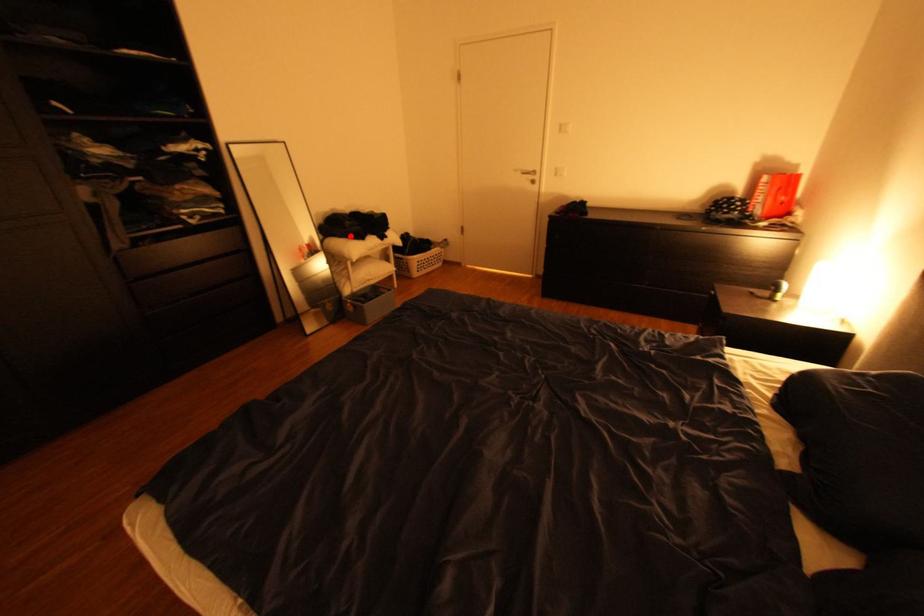
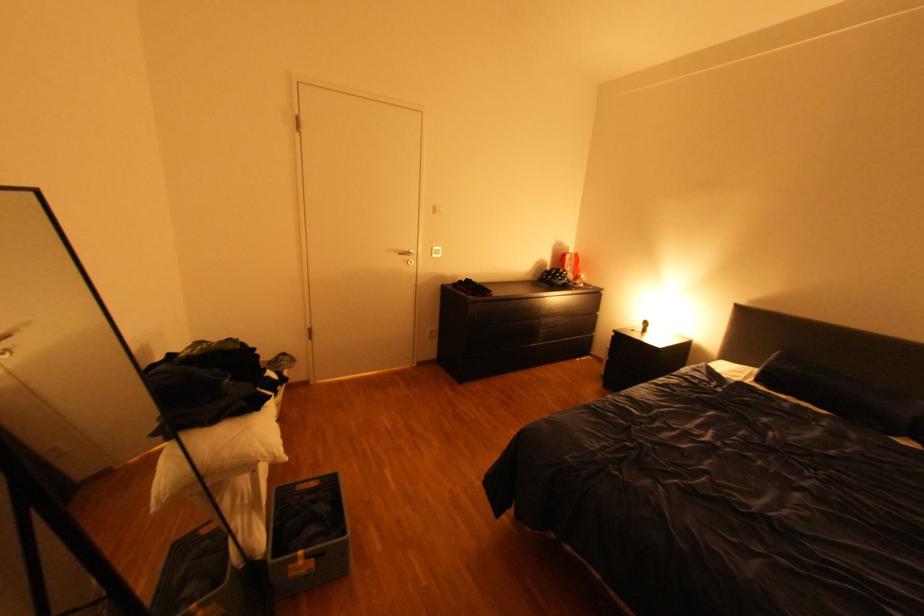
Question: I am providing you with two images of the same scene from different viewpoints. A red point is shown in image1. For the corresponding object point in image2, is it positioned nearer or farther from the camera?

Choices:
 (A) Nearer
 (B) Farther

Answer: (B)